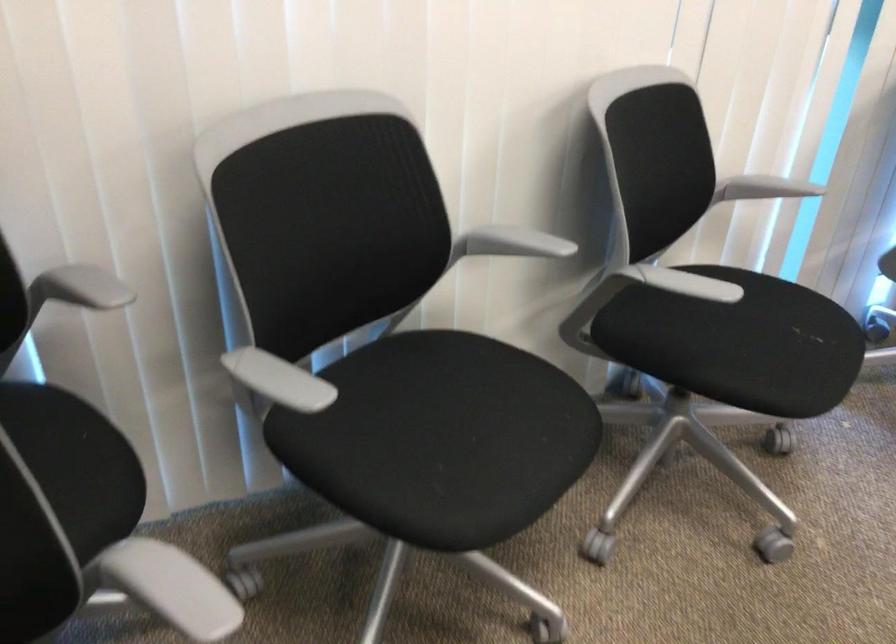
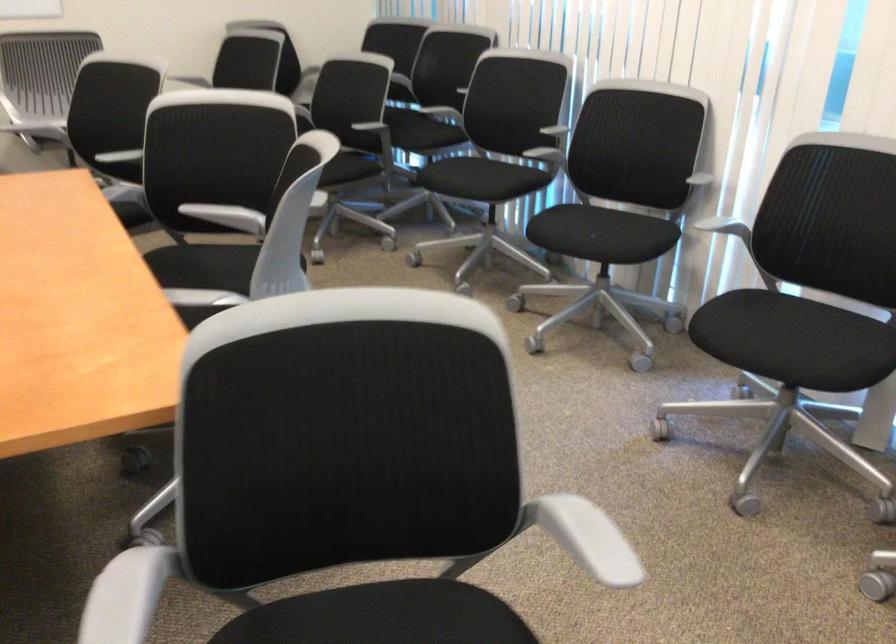
Where in the second image is the point corresponding to point (397, 292) from the first image?

(543, 146)